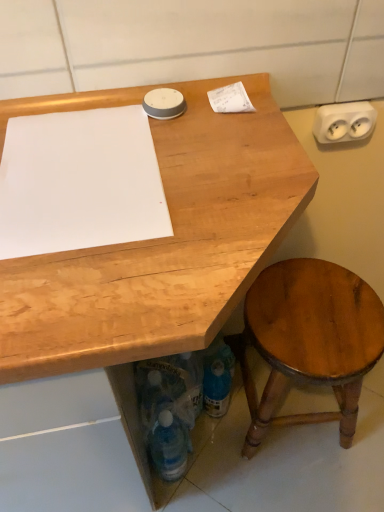
Identify the location of free space to the left of white paper at upper right, acting as the second notepad starting from the bottom. This screenshot has height=512, width=384. (125, 124).